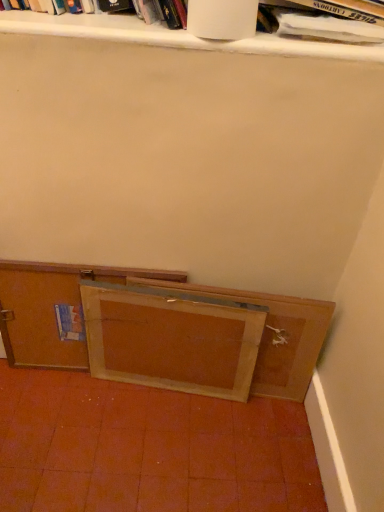
Question: Is wooden frame at lower center positioned in front of white matte book at upper center, placed as the 1th book when sorted from left to right?

Choices:
 (A) no
 (B) yes

Answer: (A)

Question: From a real-world perspective, is wooden frame at lower center positioned under white matte book at upper center, the second book viewed from the right, based on gravity?

Choices:
 (A) no
 (B) yes

Answer: (B)

Question: From the image's perspective, is wooden frame at lower center beneath white matte book at upper center, the second book viewed from the right?

Choices:
 (A) no
 (B) yes

Answer: (B)

Question: Does wooden frame at lower center have a smaller size compared to white matte book at upper center, the second book viewed from the right?

Choices:
 (A) no
 (B) yes

Answer: (B)

Question: Could white matte book at upper center, the second book viewed from the right, be considered to be inside wooden frame at lower center?

Choices:
 (A) yes
 (B) no

Answer: (B)

Question: Is white matte book at upper center, the second book viewed from the right, taller or shorter than wooden frame at lower center?

Choices:
 (A) tall
 (B) short

Answer: (B)

Question: Would you say white matte book at upper center, placed as the 1th book when sorted from left to right, is to the left or to the right of wooden frame at lower center in the picture?

Choices:
 (A) left
 (B) right

Answer: (B)

Question: From a real-world perspective, relative to wooden frame at lower center, is white matte book at upper center, placed as the 1th book when sorted from left to right, vertically above or below?

Choices:
 (A) below
 (B) above

Answer: (B)

Question: From the image's perspective, is white matte book at upper center, placed as the 1th book when sorted from left to right, above or below wooden frame at lower center?

Choices:
 (A) below
 (B) above

Answer: (B)

Question: Based on their sizes in the image, would you say white paper at upper right, the first book in the right-to-left sequence, is bigger or smaller than wooden frame at lower center, marked as the 2th cabinetry in a left-to-right arrangement?

Choices:
 (A) big
 (B) small

Answer: (A)

Question: From a real-world perspective, is white paper at upper right, which ranks as the second book in left-to-right order, above or below wooden frame at lower center, the 1th cabinetry viewed from the right?

Choices:
 (A) below
 (B) above

Answer: (B)

Question: Looking at their shapes, would you say white paper at upper right, which ranks as the second book in left-to-right order, is wider or thinner than wooden frame at lower center, the 1th cabinetry viewed from the right?

Choices:
 (A) wide
 (B) thin

Answer: (A)

Question: Is white paper at upper right, the first book in the right-to-left sequence, inside or outside of wooden frame at lower center, the 1th cabinetry viewed from the right?

Choices:
 (A) inside
 (B) outside

Answer: (B)

Question: Relative to white matte book at upper center, the second book viewed from the right, is wooden cabinet at lower left, the 2th cabinetry in the right-to-left sequence, in front or behind?

Choices:
 (A) behind
 (B) front

Answer: (A)

Question: Considering the relative positions of wooden cabinet at lower left, which ranks as the first cabinetry in left-to-right order, and white matte book at upper center, the second book viewed from the right, in the image provided, is wooden cabinet at lower left, which ranks as the first cabinetry in left-to-right order, to the left or to the right of white matte book at upper center, the second book viewed from the right,?

Choices:
 (A) right
 (B) left

Answer: (B)